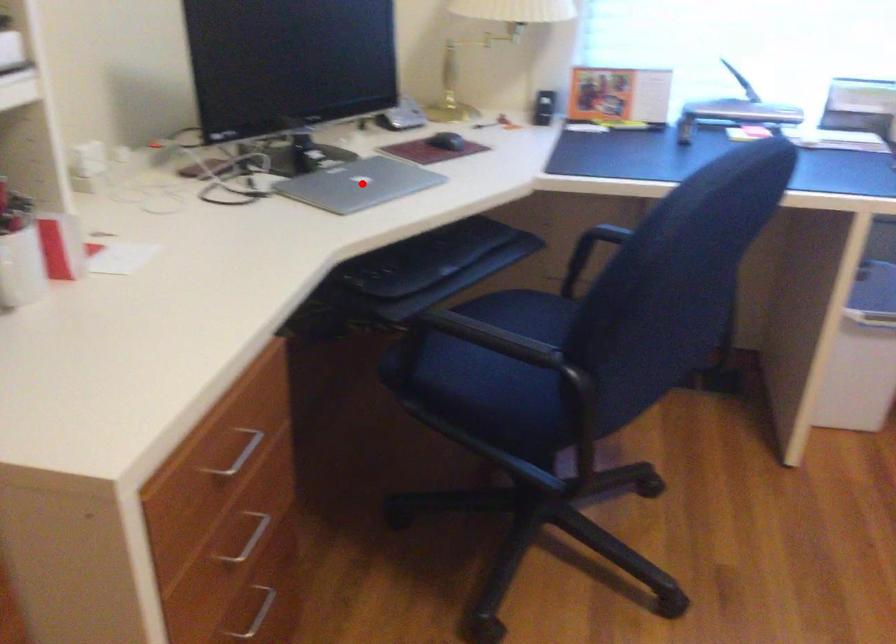
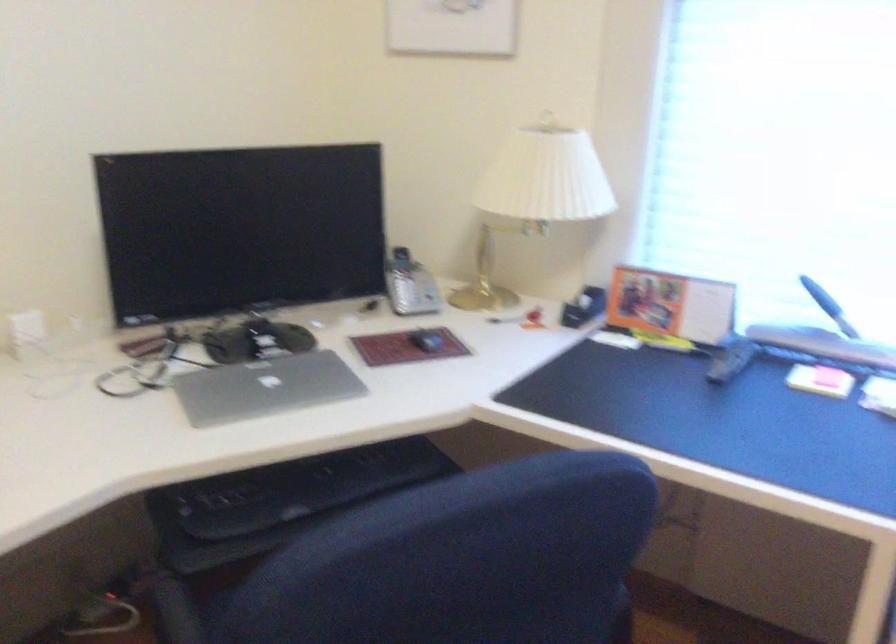
Question: I am providing you with two images of the same scene from different viewpoints. Image1 has a red point marked. In image2, the corresponding 3D location appears at what relative position? Reply with the corresponding letter.

Choices:
 (A) Closer
 (B) Farther

Answer: (A)